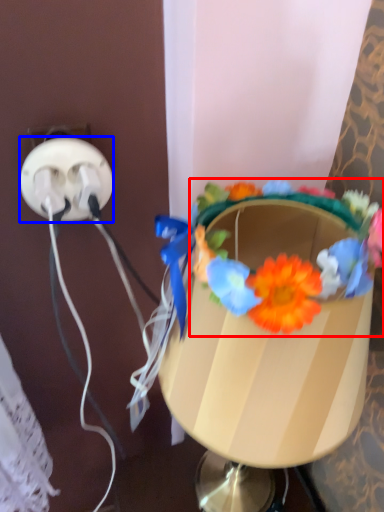
Question: Among these objects, which one is nearest to the camera, flower (highlighted by a red box) or power plugs and sockets (highlighted by a blue box)?

Choices:
 (A) flower
 (B) power plugs and sockets

Answer: (A)